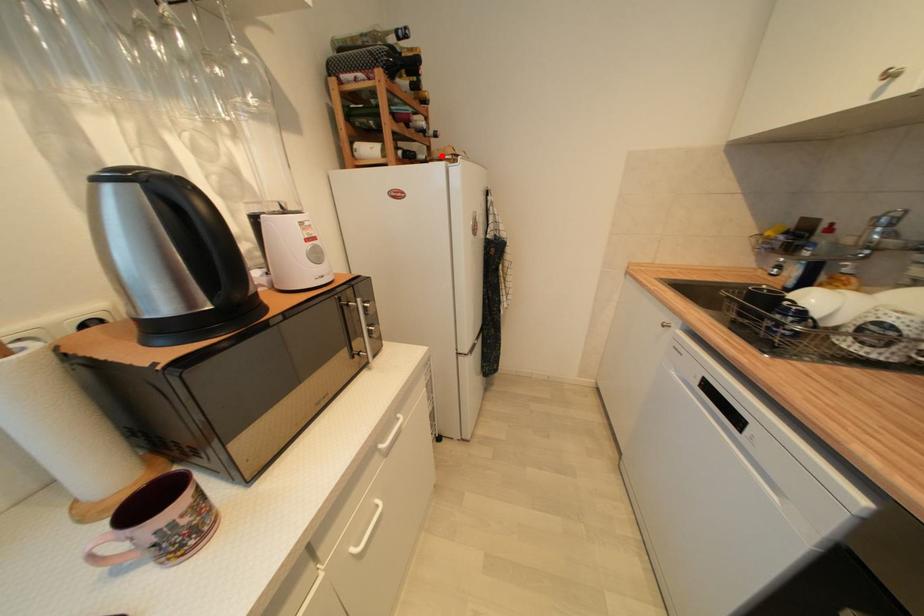
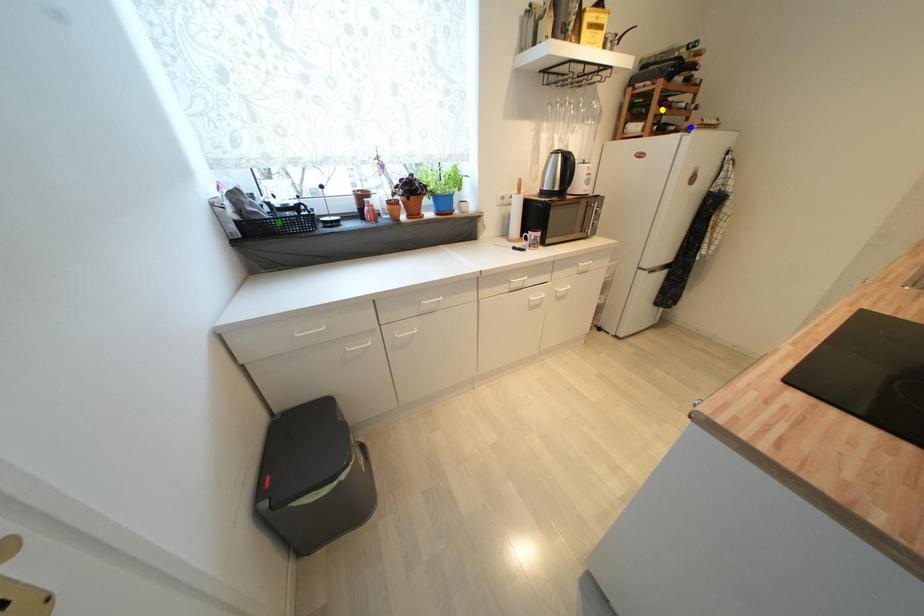
Question: I am providing you with two images of the same scene from different viewpoints. A red point is marked on the first image. You are given multiple points on the second image. Which mark in image 2 goes with the point in image 1?

Choices:
 (A) green point
 (B) yellow point
 (C) blue point

Answer: (C)